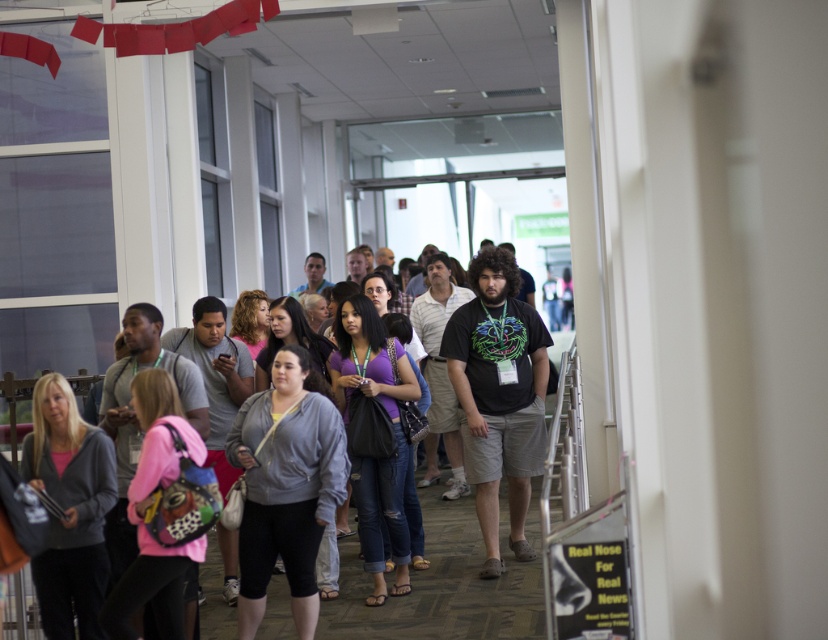
You are an event organizer who needs to ensure that attendees are appropriately dressed for an upcoming outdoor event. You notice two attendees wearing the gray hoodie at center and the gray fleece jacket at center. Which of these two items would provide better insulation against cold weather?

The gray fleece jacket at center provides better insulation against cold weather because it is thicker than the gray hoodie at center.

Where is the gray hoodie at center located in the image?

The gray hoodie at center is located at point (441,584).